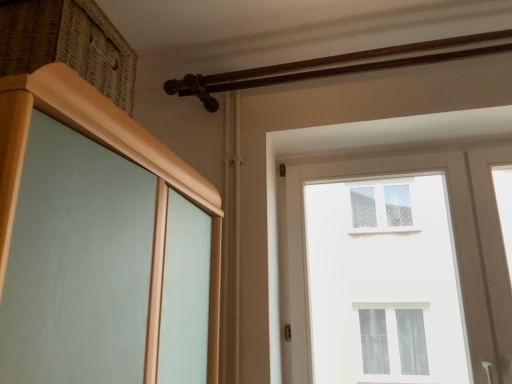
Question: From a real-world perspective, is woven wood drawer at upper left under brown wooden rail at upper center?

Choices:
 (A) no
 (B) yes

Answer: (B)

Question: From the image's perspective, is woven wood drawer at upper left located above brown wooden rail at upper center?

Choices:
 (A) no
 (B) yes

Answer: (A)

Question: Can you confirm if woven wood drawer at upper left is shorter than brown wooden rail at upper center?

Choices:
 (A) yes
 (B) no

Answer: (B)

Question: Does woven wood drawer at upper left have a greater height compared to brown wooden rail at upper center?

Choices:
 (A) yes
 (B) no

Answer: (A)

Question: Is woven wood drawer at upper left outside brown wooden rail at upper center?

Choices:
 (A) no
 (B) yes

Answer: (B)

Question: Considering the positions of point (462, 54) and point (46, 54), is point (462, 54) closer or farther from the camera than point (46, 54)?

Choices:
 (A) closer
 (B) farther

Answer: (B)

Question: Based on their sizes in the image, would you say brown wooden rail at upper center is bigger or smaller than woven wood drawer at upper left?

Choices:
 (A) small
 (B) big

Answer: (B)

Question: Considering the relative positions of brown wooden rail at upper center and woven wood drawer at upper left in the image provided, is brown wooden rail at upper center to the left or to the right of woven wood drawer at upper left?

Choices:
 (A) right
 (B) left

Answer: (A)

Question: From a real-world perspective, is brown wooden rail at upper center above or below woven wood drawer at upper left?

Choices:
 (A) below
 (B) above

Answer: (B)

Question: From the image's perspective, is brown wooden rail at upper center positioned above or below white glass window at upper center?

Choices:
 (A) above
 (B) below

Answer: (A)

Question: Considering the positions of brown wooden rail at upper center and white glass window at upper center in the image, is brown wooden rail at upper center taller or shorter than white glass window at upper center?

Choices:
 (A) tall
 (B) short

Answer: (B)

Question: Visually, is brown wooden rail at upper center positioned to the left or to the right of white glass window at upper center?

Choices:
 (A) right
 (B) left

Answer: (B)

Question: Is brown wooden rail at upper center bigger or smaller than white glass window at upper center?

Choices:
 (A) small
 (B) big

Answer: (B)

Question: Visually, is woven wood drawer at upper left positioned to the left or to the right of white glass window at upper center?

Choices:
 (A) right
 (B) left

Answer: (B)

Question: Is point (80, 44) positioned closer to the camera than point (508, 347)?

Choices:
 (A) closer
 (B) farther

Answer: (A)